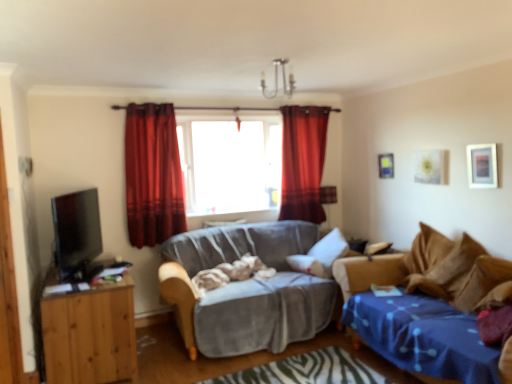
Question: Would you say velvet red curtain at center, which is counted as the 2th curtain, starting from the right, is inside or outside velvet gray couch at center, placed as the first studio couch when sorted from left to right?

Choices:
 (A) inside
 (B) outside

Answer: (B)

Question: Is point (126, 155) closer or farther from the camera than point (285, 291)?

Choices:
 (A) closer
 (B) farther

Answer: (B)

Question: Considering the real-world distances, which object is farthest from the velvet gray couch at center, placed as the first studio couch when sorted from left to right?

Choices:
 (A) black glossy tv at left
 (B) transparent glass window at center
 (C) velvet red curtain at center, marked as the 1th curtain in a left-to-right arrangement
 (D) velvet-like red curtain at center, which is counted as the 1th curtain, starting from the back
 (E) wooden picture frame at upper right, the first picture frame from the right

Answer: (E)

Question: Based on their relative distances, which object is nearer to the wooden picture frame at upper right, the first picture frame from the right?

Choices:
 (A) transparent glass window at center
 (B) velvet-like red curtain at center, which is counted as the 1th curtain, starting from the back
 (C) blue fabric studio couch at right, the 2th studio couch in the left-to-right sequence
 (D) velvet red curtain at center, marked as the 1th curtain in a left-to-right arrangement
 (E) black glossy tv at left

Answer: (C)